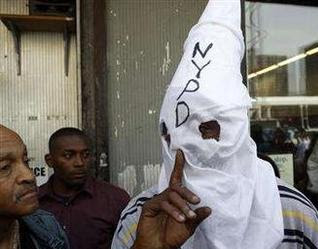
Locate an element on the screen. door is located at coordinates (146, 75).